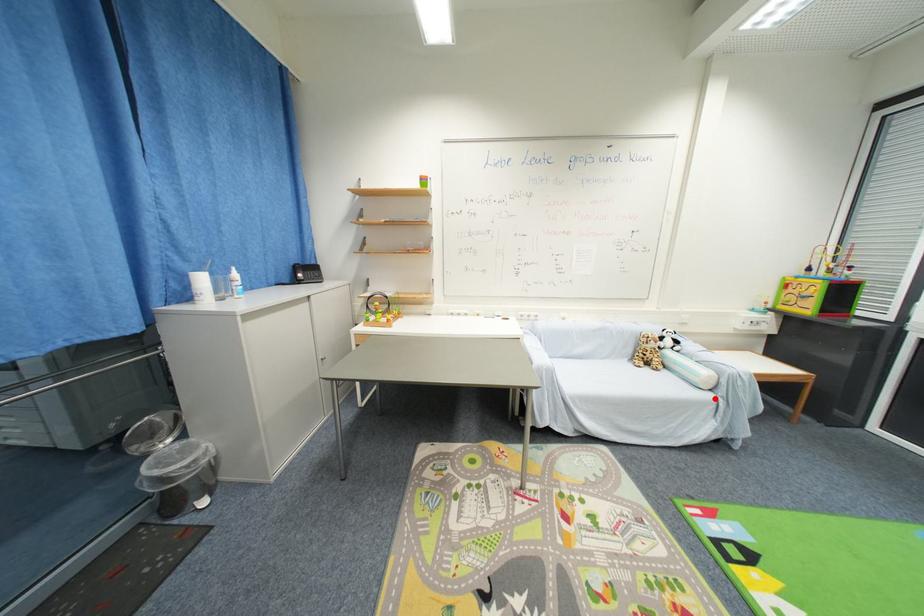
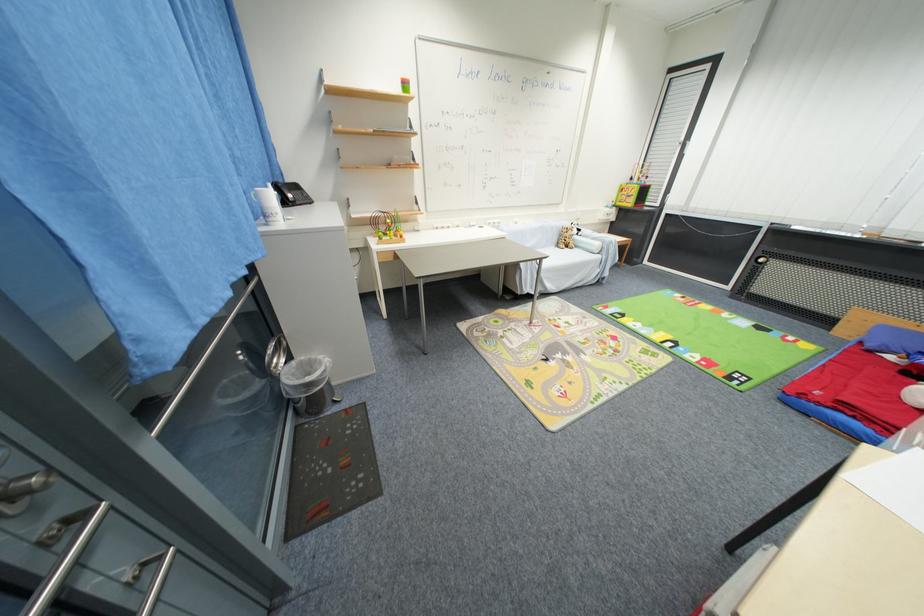
Question: I am providing you with two images of the same scene from different viewpoints. Given a red point in image1, look at the same physical point in image2. Is it:

Choices:
 (A) Closer to the viewpoint
 (B) Farther from the viewpoint

Answer: (A)